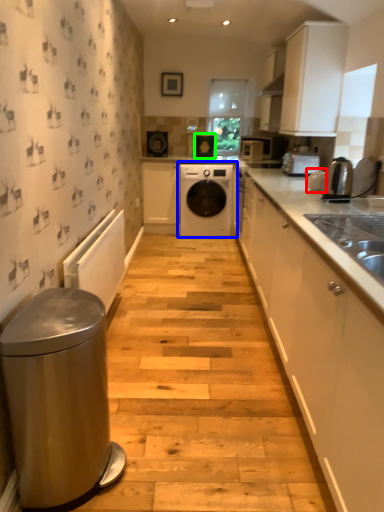
Question: Considering the real-world distances, which object is farthest from appliance (highlighted by a red box)? washing machine (highlighted by a blue box) or appliance (highlighted by a green box)?

Choices:
 (A) washing machine
 (B) appliance

Answer: (B)